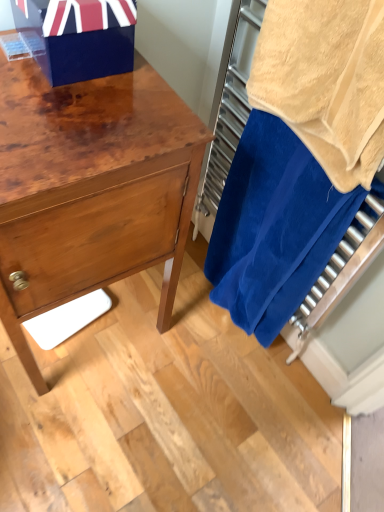
Measure the distance between point (325, 126) and camera.

The depth of point (325, 126) is 31.46 inches.

This screenshot has width=384, height=512. What do you see at coordinates (325, 81) in the screenshot? I see `beige terry cloth towel at right` at bounding box center [325, 81].

You are a GUI agent. You are given a task and a screenshot of the screen. Output one action in this format:
    pyautogui.click(x=<x>, y=<y>)
    Task: Click on the shiny blue gift box at upper left
    
    Given the screenshot: What is the action you would take?
    pyautogui.click(x=80, y=36)

In order to face shiny wood chest of drawers at left, should I rotate leftwards or rightwards?

Turn left by 15.836 degrees to look at shiny wood chest of drawers at left.

Where is `blue terry cloth towel at right`? blue terry cloth towel at right is located at coordinates (273, 213).

Considering the relative positions of blue terry cloth towel at right and shiny wood chest of drawers at left in the image provided, is blue terry cloth towel at right to the left or to the right of shiny wood chest of drawers at left?

In the image, blue terry cloth towel at right appears on the right side of shiny wood chest of drawers at left.

From a real-world perspective, is blue terry cloth towel at right positioned over shiny wood chest of drawers at left based on gravity?

Yes, from a real-world perspective, blue terry cloth towel at right is above shiny wood chest of drawers at left.

What are the coordinates of `laundry lying behind the shiny wood chest of drawers at left` in the screenshot? It's located at (273, 213).

Measure the distance from beige terry cloth towel at right to blue terry cloth towel at right.

9.48 inches.

Is beige terry cloth towel at right not within blue terry cloth towel at right?

Yes, beige terry cloth towel at right is outside of blue terry cloth towel at right.

Is beige terry cloth towel at right thinner than blue terry cloth towel at right?

In fact, beige terry cloth towel at right might be wider than blue terry cloth towel at right.

Where is `bath towel located above the blue terry cloth towel at right (from the image's perspective)`? Image resolution: width=384 pixels, height=512 pixels. bath towel located above the blue terry cloth towel at right (from the image's perspective) is located at coordinates (325, 81).

Is shiny blue gift box at upper left at the back of shiny wood chest of drawers at left?

No, shiny wood chest of drawers at left's orientation is not away from shiny blue gift box at upper left.

Who is taller, shiny wood chest of drawers at left or shiny blue gift box at upper left?

shiny wood chest of drawers at left is taller.

Can we say shiny wood chest of drawers at left lies outside shiny blue gift box at upper left?

Yes, shiny wood chest of drawers at left is not within shiny blue gift box at upper left.

Between shiny blue gift box at upper left and shiny wood chest of drawers at left, which one is positioned behind?

shiny blue gift box at upper left is more distant.

Consider the image. From a real-world perspective, is shiny blue gift box at upper left physically located above or below shiny wood chest of drawers at left?

In terms of real-world spatial position, shiny blue gift box at upper left is above shiny wood chest of drawers at left.

Between shiny blue gift box at upper left and shiny wood chest of drawers at left, which one has smaller size?

shiny blue gift box at upper left is smaller.

Identify the location of the chest of drawers that appears in front of the shiny blue gift box at upper left. (91, 188).

Between blue terry cloth towel at right and beige terry cloth towel at right, which one is positioned in front?

beige terry cloth towel at right is in front.

Is blue terry cloth towel at right aimed at beige terry cloth towel at right?

Yes.

Considering the relative sizes of blue terry cloth towel at right and beige terry cloth towel at right in the image provided, is blue terry cloth towel at right shorter than beige terry cloth towel at right?

No.

Would you say blue terry cloth towel at right is inside or outside beige terry cloth towel at right?

blue terry cloth towel at right is not inside beige terry cloth towel at right, it's outside.

How much distance is there between blue terry cloth towel at right and shiny blue gift box at upper left?

blue terry cloth towel at right is 51.53 centimeters away from shiny blue gift box at upper left.

Relative to shiny blue gift box at upper left, is blue terry cloth towel at right in front or behind?

blue terry cloth towel at right is behind shiny blue gift box at upper left.

From the image's perspective, is blue terry cloth towel at right over shiny blue gift box at upper left?

No, from the image's perspective, blue terry cloth towel at right is not over shiny blue gift box at upper left.

How many degrees apart are the facing directions of blue terry cloth towel at right and shiny blue gift box at upper left?

They differ by 85.5 degrees in their facing directions.

Between shiny wood chest of drawers at left and beige terry cloth towel at right, which one has more height?

shiny wood chest of drawers at left is taller.

Looking at this image, does shiny wood chest of drawers at left have a lesser width compared to beige terry cloth towel at right?

No.

Between point (65, 174) and point (262, 104), which one is positioned behind?

The point (262, 104) is behind.

Visually, is shiny wood chest of drawers at left positioned to the left or to the right of beige terry cloth towel at right?

Clearly, shiny wood chest of drawers at left is on the left of beige terry cloth towel at right in the image.

Find the location of `chest of drawers below the blue terry cloth towel at right (from the image's perspective)`. chest of drawers below the blue terry cloth towel at right (from the image's perspective) is located at coordinates (91, 188).

The height and width of the screenshot is (512, 384). I want to click on laundry to the left of beige terry cloth towel at right, so click(273, 213).

When comparing their distances from shiny blue gift box at upper left, does shiny wood chest of drawers at left or beige terry cloth towel at right seem further?

Based on the image, beige terry cloth towel at right appears to be further to shiny blue gift box at upper left.

When comparing their distances from blue terry cloth towel at right, does beige terry cloth towel at right or shiny wood chest of drawers at left seem closer?

The object closer to blue terry cloth towel at right is beige terry cloth towel at right.

Based on their spatial positions, is beige terry cloth towel at right or shiny blue gift box at upper left closer to blue terry cloth towel at right?

beige terry cloth towel at right is positioned closer to the anchor blue terry cloth towel at right.

Looking at the image, which one is located further to beige terry cloth towel at right, shiny blue gift box at upper left or blue terry cloth towel at right?

The object further to beige terry cloth towel at right is shiny blue gift box at upper left.

Considering their positions, is blue terry cloth towel at right positioned further to shiny blue gift box at upper left than beige terry cloth towel at right?

blue terry cloth towel at right is positioned further to the anchor shiny blue gift box at upper left.

When comparing their distances from shiny wood chest of drawers at left, does shiny blue gift box at upper left or blue terry cloth towel at right seem further?

Among the two, blue terry cloth towel at right is located further to shiny wood chest of drawers at left.

Which object lies nearer to the anchor point shiny blue gift box at upper left, beige terry cloth towel at right or blue terry cloth towel at right?

beige terry cloth towel at right lies closer to shiny blue gift box at upper left than the other object.

Looking at the image, which one is located closer to beige terry cloth towel at right, shiny wood chest of drawers at left or blue terry cloth towel at right?

Based on the image, blue terry cloth towel at right appears to be nearer to beige terry cloth towel at right.

This screenshot has width=384, height=512. Identify the location of laundry situated between shiny wood chest of drawers at left and beige terry cloth towel at right from left to right. (273, 213).

This screenshot has width=384, height=512. I want to click on gift box between shiny wood chest of drawers at left and beige terry cloth towel at right, so pos(80,36).

Locate an element on the screen. laundry between shiny blue gift box at upper left and beige terry cloth towel at right in the horizontal direction is located at coordinates (273, 213).

Locate an element on the screen. This screenshot has height=512, width=384. gift box between shiny wood chest of drawers at left and blue terry cloth towel at right from left to right is located at coordinates (80, 36).